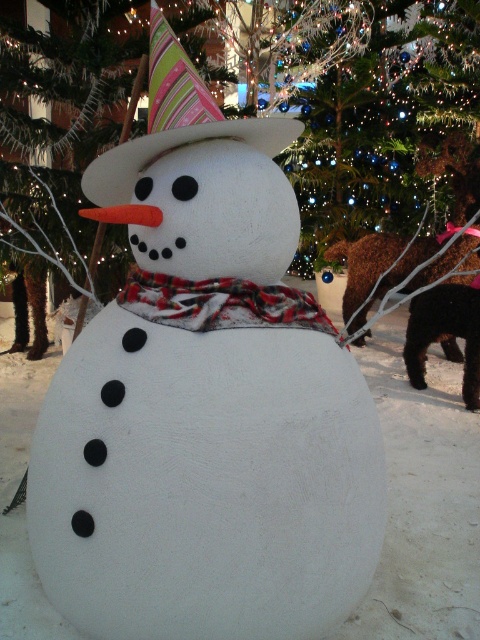
Can you confirm if white matte snowman at center is bigger than plaid fabric scarf at center?

Yes.

Does white matte snowman at center have a lesser height compared to plaid fabric scarf at center?

No, white matte snowman at center is not shorter than plaid fabric scarf at center.

Who is more distant from viewer, (409,636) or (220,307)?

Positioned behind is point (409,636).

Where is `white matte snowman at center`? white matte snowman at center is located at coordinates (422, 499).

Is white matte snowman at center closer to camera compared to green glittery christmas tree at center?

Yes, white matte snowman at center is closer to the viewer.

Does white matte snowman at center come behind green glittery christmas tree at center?

That is False.

Does point (23, 570) lie behind point (479, 198)?

No, it is not.

In order to click on white matte snowman at center in this screenshot , I will do `click(422, 499)`.

Who is more distant from viewer, (48, 236) or (120, 200)?

The point (48, 236) is behind.

Between green glittery christmas tree at center and striped fabric party hat at upper center, which one has more height?

green glittery christmas tree at center

This screenshot has width=480, height=640. I want to click on green glittery christmas tree at center, so click(179, 122).